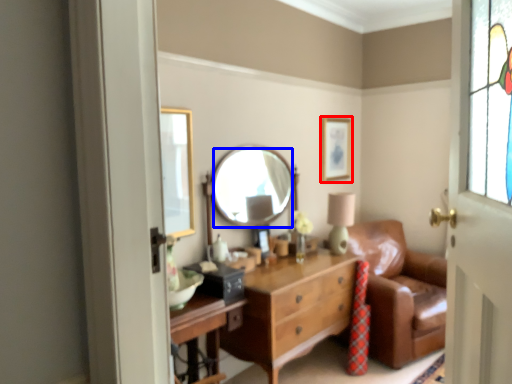
Question: Which object is further to the camera taking this photo, picture frame (highlighted by a red box) or mirror (highlighted by a blue box)?

Choices:
 (A) picture frame
 (B) mirror

Answer: (A)